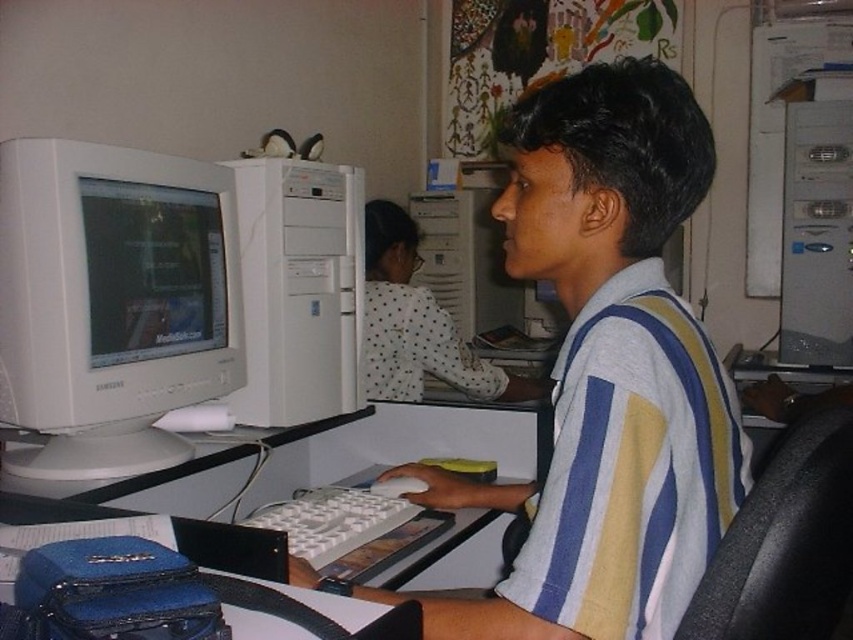
You are organizing a desk and need to place the matte white monitor at left and the white plastic keyboard at center. Which object requires more horizontal space on the desk?

The white plastic keyboard at center requires more horizontal space on the desk because it has a greater width than the matte white monitor at left.

You are standing in the workspace and want to reach both the point at (248, 296) and the point at (225, 262). Which point is closer to you?

The point at (225, 262) is closer to you because it is less further than the point at (248, 296).